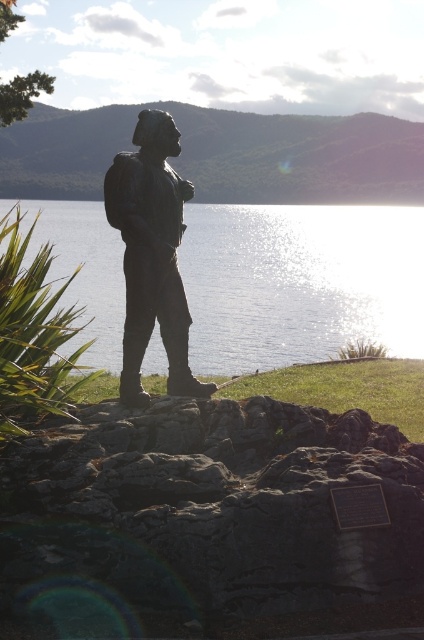
Does glistening metallic water at center lie behind bronze statue at center?

That is True.

Is glistening metallic water at center shorter than bronze statue at center?

In fact, glistening metallic water at center may be taller than bronze statue at center.

Does point (368, 260) come behind point (158, 307)?

Yes, point (368, 260) is behind point (158, 307).

Where is `glistening metallic water at center`? Image resolution: width=424 pixels, height=640 pixels. glistening metallic water at center is located at coordinates (300, 282).

From the picture: Between rough textured rock at center and glistening metallic water at center, which one has more height?

glistening metallic water at center is taller.

Between rough textured rock at center and glistening metallic water at center, which one is positioned lower?

rough textured rock at center is lower down.

Which is behind, point (365, 563) or point (381, 305)?

Positioned behind is point (381, 305).

Image resolution: width=424 pixels, height=640 pixels. I want to click on rough textured rock at center, so click(x=203, y=515).

Is rough textured rock at center taller than bronze statue at center?

Incorrect, rough textured rock at center's height is not larger of bronze statue at center's.

How much distance is there between rough textured rock at center and bronze statue at center?

rough textured rock at center and bronze statue at center are 1.15 meters apart from each other.

Which is in front, point (339, 442) or point (175, 301)?

Positioned in front is point (339, 442).

Where is `rough textured rock at center`? Image resolution: width=424 pixels, height=640 pixels. rough textured rock at center is located at coordinates (203, 515).